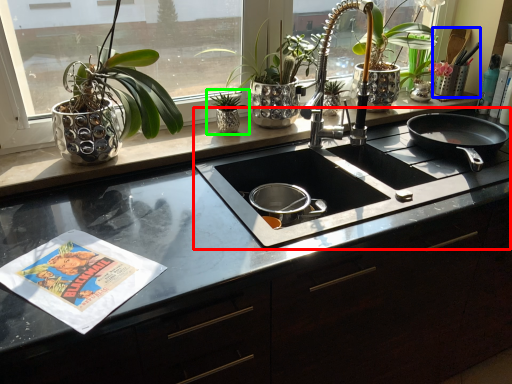
Question: Which object is positioned closest to gas stove (highlighted by a red box)? Select from appliance (highlighted by a blue box) and houseplant (highlighted by a green box).

Choices:
 (A) appliance
 (B) houseplant

Answer: (B)